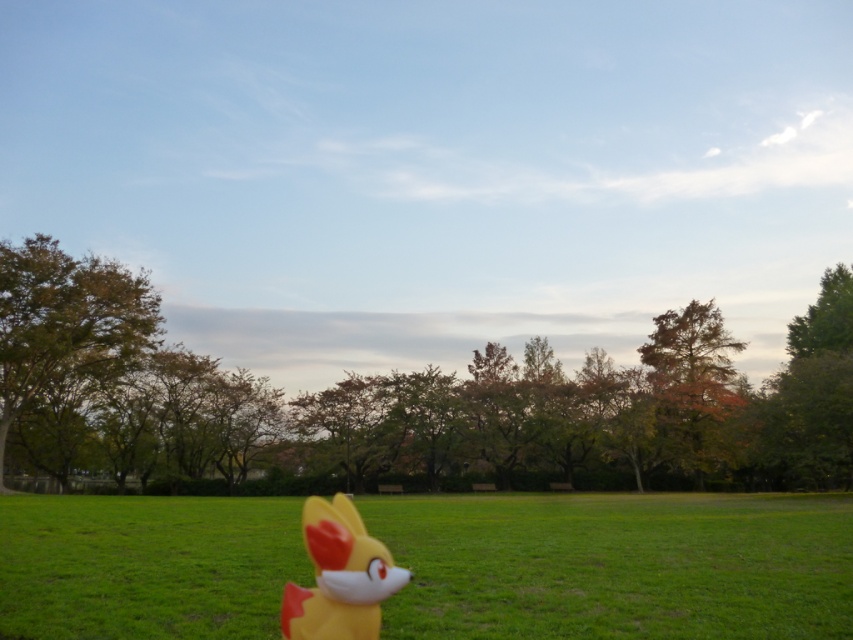
Question: Observing the image, what is the correct spatial positioning of brown textured tree at left in reference to autumn leaves at right?

Choices:
 (A) left
 (B) right

Answer: (A)

Question: Can you confirm if brown textured tree at left is positioned above yellow matte plush toy at lower center?

Choices:
 (A) yes
 (B) no

Answer: (A)

Question: Considering the real-world distances, which object is closest to the green leafy tree at center?

Choices:
 (A) autumn leaves at right
 (B) yellow rubber fox at center

Answer: (A)

Question: Considering the relative positions of green leafy tree at center and yellow matte plush toy at lower center in the image provided, where is green leafy tree at center located with respect to yellow matte plush toy at lower center?

Choices:
 (A) above
 (B) below

Answer: (A)

Question: Estimate the real-world distances between objects in this image. Which object is farther from the yellow matte plush toy at lower center?

Choices:
 (A) brown textured tree at left
 (B) autumn leaves at right
 (C) green leafy tree at center
 (D) yellow rubber fox at center

Answer: (B)

Question: Which is nearer to the yellow rubber fox at center?

Choices:
 (A) brown textured tree at left
 (B) green leafy tree at center

Answer: (A)